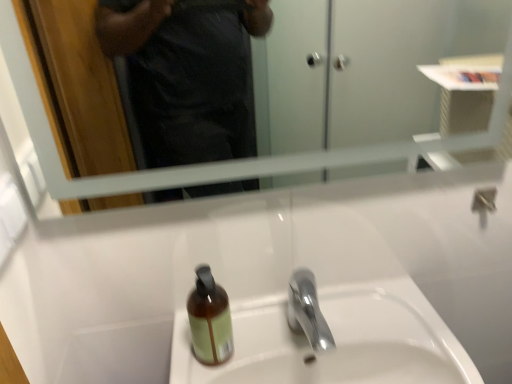
Question: Can you confirm if polished chrome faucet at center is taller than clear glass mirror at upper center?

Choices:
 (A) no
 (B) yes

Answer: (A)

Question: From the image's perspective, is polished chrome faucet at center located beneath clear glass mirror at upper center?

Choices:
 (A) no
 (B) yes

Answer: (B)

Question: From the image's perspective, is polished chrome faucet at center above clear glass mirror at upper center?

Choices:
 (A) no
 (B) yes

Answer: (A)

Question: Is polished chrome faucet at center positioned in front of clear glass mirror at upper center?

Choices:
 (A) no
 (B) yes

Answer: (A)

Question: From a real-world perspective, is polished chrome faucet at center physically above clear glass mirror at upper center?

Choices:
 (A) no
 (B) yes

Answer: (A)

Question: Considering the relative positions of brown glass bottle at center and white ceramic sink at center in the image provided, is brown glass bottle at center to the left or to the right of white ceramic sink at center?

Choices:
 (A) right
 (B) left

Answer: (B)

Question: Is brown glass bottle at center bigger or smaller than white ceramic sink at center?

Choices:
 (A) small
 (B) big

Answer: (A)

Question: From a real-world perspective, is brown glass bottle at center above or below white ceramic sink at center?

Choices:
 (A) below
 (B) above

Answer: (B)

Question: Considering the positions of brown glass bottle at center and white ceramic sink at center in the image, is brown glass bottle at center taller or shorter than white ceramic sink at center?

Choices:
 (A) short
 (B) tall

Answer: (B)

Question: In the image, is brown glass bottle at center on the left side or the right side of clear glass mirror at upper center?

Choices:
 (A) right
 (B) left

Answer: (B)

Question: Looking at the image, does brown glass bottle at center seem bigger or smaller compared to clear glass mirror at upper center?

Choices:
 (A) small
 (B) big

Answer: (A)

Question: Which is correct: brown glass bottle at center is inside clear glass mirror at upper center, or outside of it?

Choices:
 (A) inside
 (B) outside

Answer: (B)

Question: Is point (226, 319) closer or farther from the camera than point (164, 172)?

Choices:
 (A) farther
 (B) closer

Answer: (B)

Question: In the image, is clear glass mirror at upper center on the left side or the right side of white ceramic sink at center?

Choices:
 (A) right
 (B) left

Answer: (B)

Question: Is clear glass mirror at upper center in front of or behind white ceramic sink at center in the image?

Choices:
 (A) front
 (B) behind

Answer: (A)